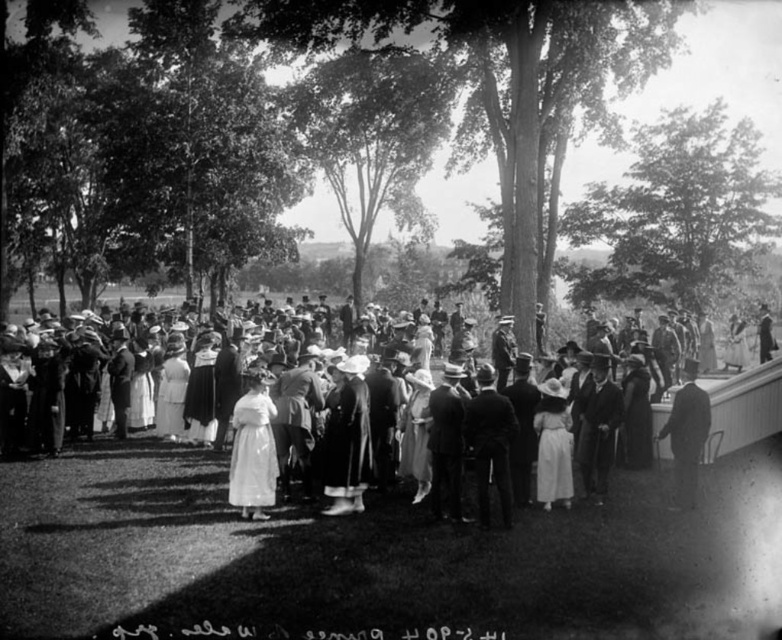
Question: Which object appears farthest from the camera in this image?

Choices:
 (A) smooth black suit at right
 (B) white cotton dress at center

Answer: (A)

Question: Which point is closer to the camera?

Choices:
 (A) (705, 397)
 (B) (250, 532)

Answer: (B)

Question: Does white cotton dress at center appear on the left side of smooth black suit at right?

Choices:
 (A) yes
 (B) no

Answer: (A)

Question: In this image, where is white cotton dress at center located relative to smooth black suit at right?

Choices:
 (A) above
 (B) below

Answer: (A)

Question: Does white cotton dress at center have a larger size compared to smooth black suit at right?

Choices:
 (A) no
 (B) yes

Answer: (B)